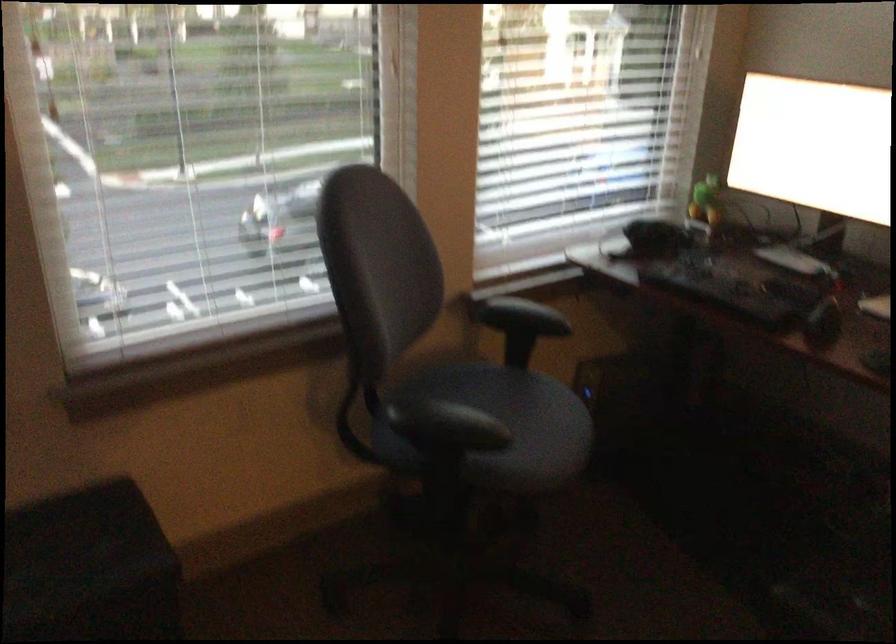
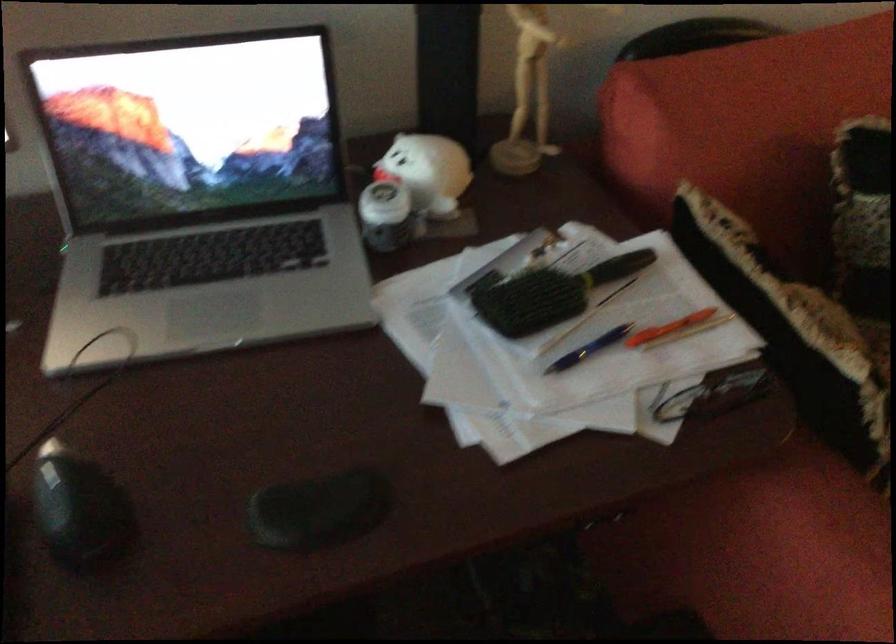
Where in the second image is the point corresponding to (823,310) from the first image?

(80, 511)